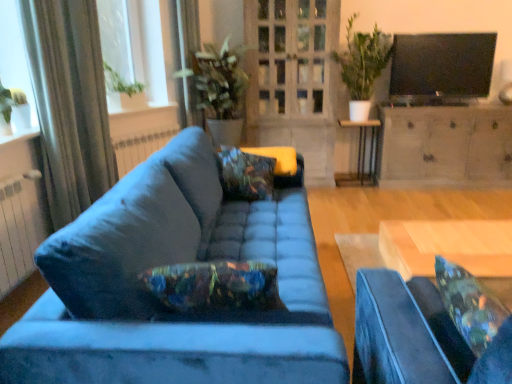
You are a GUI agent. You are given a task and a screenshot of the screen. Output one action in this format:
    pyautogui.click(x=<x>, y=<y>)
    Task: Click on the vacant space underneath wooden desk at center (from a real-world perspective)
    This screenshot has height=384, width=512.
    Given the screenshot: What is the action you would take?
    pyautogui.click(x=489, y=240)